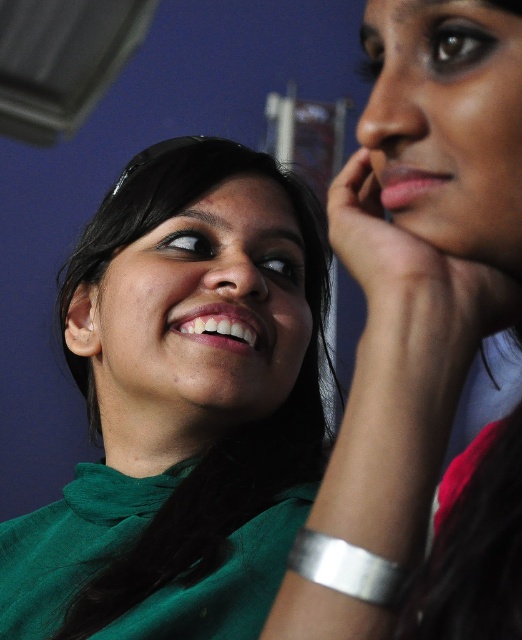
Does point (492, 616) lie in front of point (518, 228)?

Yes, point (492, 616) is in front of point (518, 228).

Between matte green shirt at upper left and matte skin face at upper right, which one appears on the right side from the viewer's perspective?

Positioned to the right is matte skin face at upper right.

Measure the distance between matte green shirt at upper left and camera.

matte green shirt at upper left and camera are 15.62 inches apart.

This screenshot has width=522, height=640. In order to click on matte green shirt at upper left in this screenshot , I will do `click(422, 253)`.

Who is more forward, (470, 509) or (124, 323)?

Point (470, 509) is in front.

How far apart are matte green shirt at upper left and matte green face at center?

matte green shirt at upper left is 13.59 inches away from matte green face at center.

The height and width of the screenshot is (640, 522). Find the location of `matte green shirt at upper left`. matte green shirt at upper left is located at coordinates (422, 253).

Locate an element on the screen. This screenshot has width=522, height=640. green matte shirt at center is located at coordinates (182, 404).

Who is more forward, (125, 586) or (432, 145)?

Positioned in front is point (432, 145).

This screenshot has height=640, width=522. Identify the location of green matte shirt at center. (182, 404).